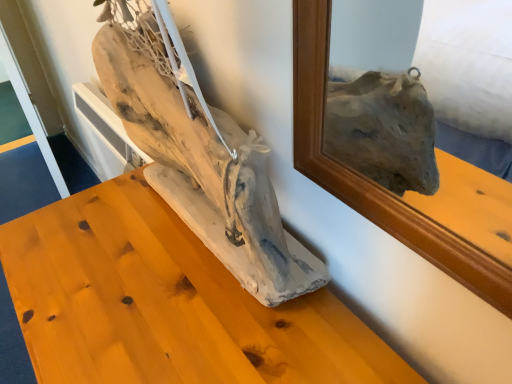
This screenshot has height=384, width=512. Identify the location of blank space to the left of natural wood driftwood at center. (89, 246).